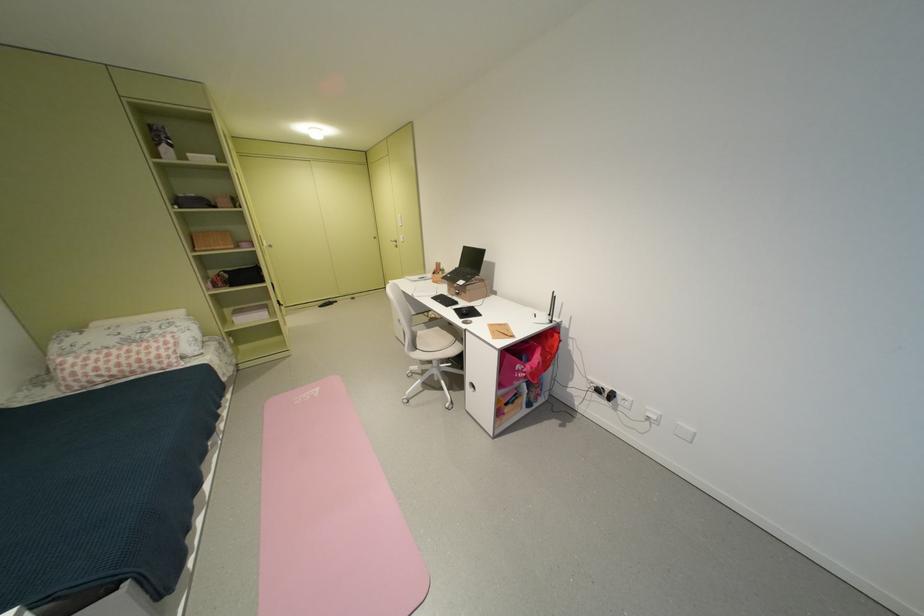
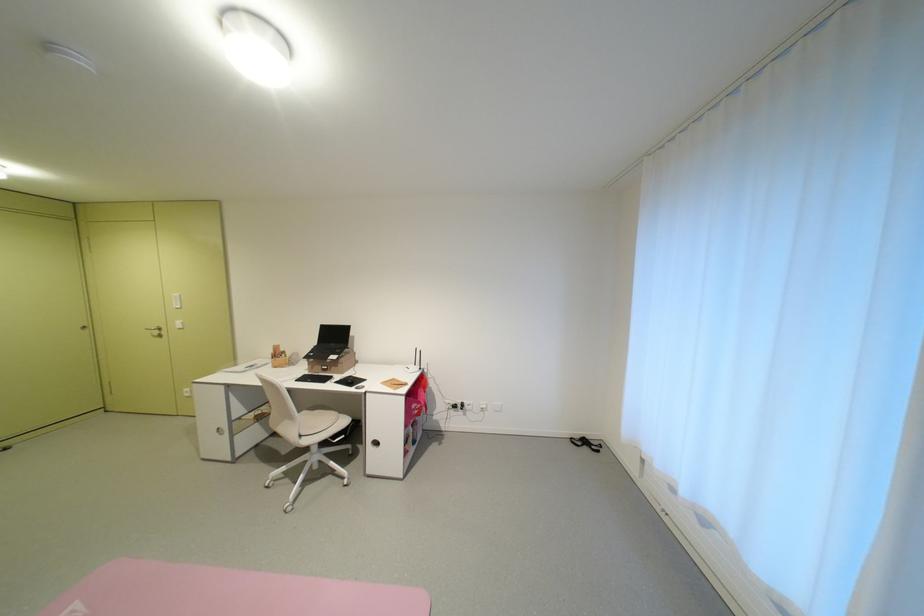
Question: The camera is either moving clockwise (left) or counter-clockwise (right) around the object. The first image is from the beginning of the video and the second image is from the end. Is the camera moving left or right when shooting the video?

Choices:
 (A) Left
 (B) Right

Answer: (A)